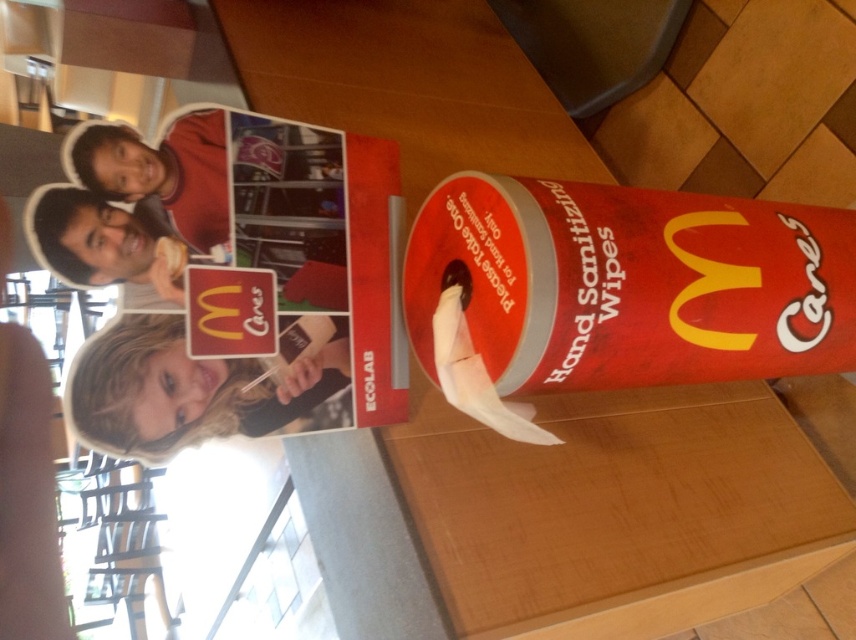
Question: Which point is closer to the camera?

Choices:
 (A) blonde hair at center
 (B) matte red shirt at upper left
 (C) matte black face mask at upper left

Answer: (C)

Question: Is matte red shirt at upper left positioned in front of matte black face mask at upper left?

Choices:
 (A) no
 (B) yes

Answer: (A)

Question: Does blonde hair at center appear on the left side of matte black face mask at upper left?

Choices:
 (A) no
 (B) yes

Answer: (A)

Question: Among these objects, which one is nearest to the camera?

Choices:
 (A) white matte toilet paper at center
 (B) blonde hair at center
 (C) matte cardboard magazine at upper left

Answer: (C)

Question: Is matte cardboard magazine at upper left positioned before matte black face mask at upper left?

Choices:
 (A) no
 (B) yes

Answer: (A)

Question: Based on their relative distances, which object is nearer to the blonde hair at center?

Choices:
 (A) white matte toilet paper at center
 (B) matte cardboard magazine at upper left
 (C) matte red shirt at upper left
 (D) matte black face mask at upper left

Answer: (B)